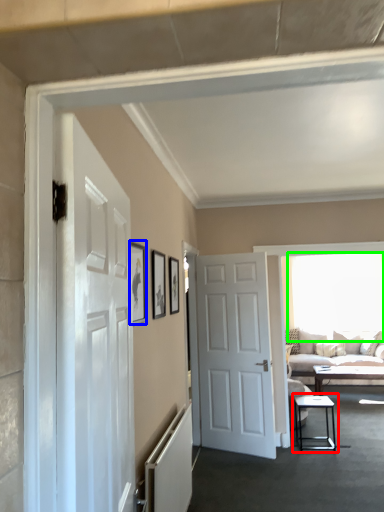
Question: Which object is positioned farthest from table (highlighted by a red box)? Select from picture frame (highlighted by a blue box) and window (highlighted by a green box).

Choices:
 (A) picture frame
 (B) window

Answer: (A)